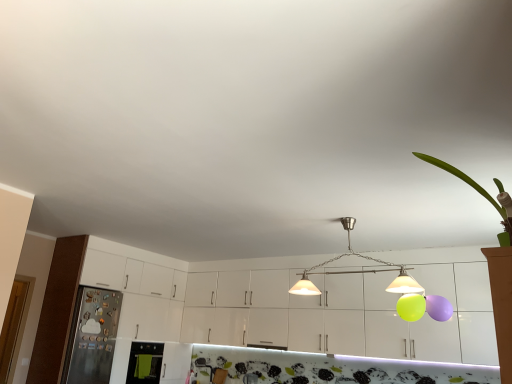
Question: Is metallic pendant lights at center oriented towards metallic refrigerator at left, acting as the first appliance starting from the left?

Choices:
 (A) no
 (B) yes

Answer: (A)

Question: Is metallic pendant lights at center facing away from metallic refrigerator at left, the 2th appliance viewed from the right?

Choices:
 (A) no
 (B) yes

Answer: (A)

Question: Does metallic pendant lights at center have a lesser height compared to metallic refrigerator at left, acting as the first appliance starting from the left?

Choices:
 (A) no
 (B) yes

Answer: (B)

Question: Is metallic pendant lights at center next to metallic refrigerator at left, acting as the first appliance starting from the left, and touching it?

Choices:
 (A) yes
 (B) no

Answer: (B)

Question: Is metallic pendant lights at center bigger than metallic refrigerator at left, acting as the first appliance starting from the left?

Choices:
 (A) no
 (B) yes

Answer: (B)

Question: Considering the relative positions of metallic pendant lights at center and metallic refrigerator at left, acting as the first appliance starting from the left, in the image provided, is metallic pendant lights at center to the left of metallic refrigerator at left, acting as the first appliance starting from the left, from the viewer's perspective?

Choices:
 (A) yes
 (B) no

Answer: (B)

Question: Is green fabric oven at lower left, the 1th appliance positioned from the right, positioned with its back to metallic refrigerator at left, the 2th appliance viewed from the right?

Choices:
 (A) no
 (B) yes

Answer: (A)

Question: Is green fabric oven at lower left, the 1th appliance positioned from the right, not near metallic refrigerator at left, acting as the first appliance starting from the left?

Choices:
 (A) yes
 (B) no

Answer: (B)

Question: From a real-world perspective, is green fabric oven at lower left, the 1th appliance positioned from the right, beneath metallic refrigerator at left, the 2th appliance viewed from the right?

Choices:
 (A) yes
 (B) no

Answer: (A)

Question: From a real-world perspective, does green fabric oven at lower left, the 1th appliance positioned from the right, stand above metallic refrigerator at left, the 2th appliance viewed from the right?

Choices:
 (A) no
 (B) yes

Answer: (A)

Question: Does green fabric oven at lower left, the 1th appliance positioned from the right, have a greater width compared to metallic refrigerator at left, the 2th appliance viewed from the right?

Choices:
 (A) yes
 (B) no

Answer: (B)

Question: Is green fabric oven at lower left, the 2th appliance from the left, surrounding metallic refrigerator at left, the 2th appliance viewed from the right?

Choices:
 (A) no
 (B) yes

Answer: (A)

Question: Does metallic pendant lights at center have a greater width compared to green leafy plant at upper right?

Choices:
 (A) yes
 (B) no

Answer: (A)